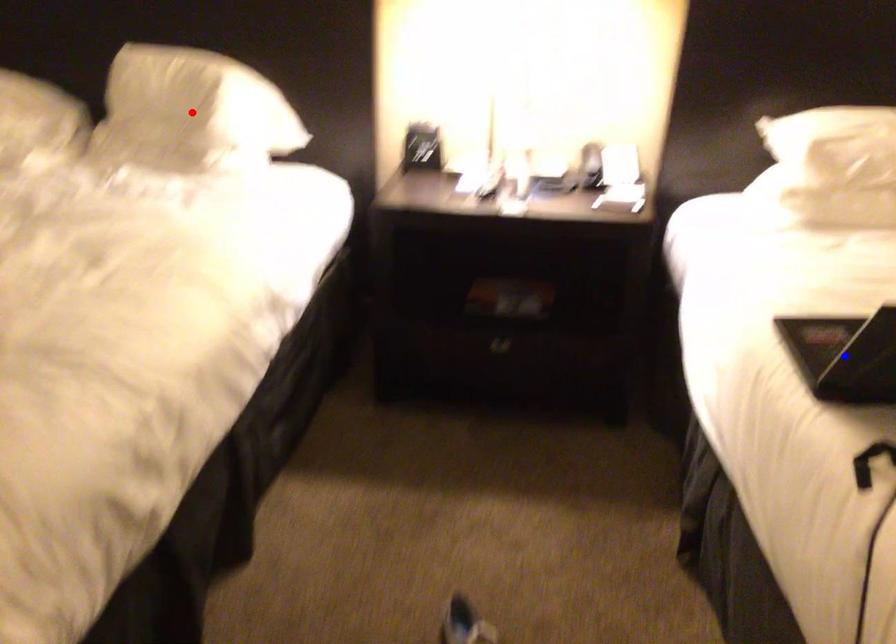
Question: Two points are marked on the image. Which point is closer to the camera?

Choices:
 (A) Blue point is closer.
 (B) Red point is closer.

Answer: (A)